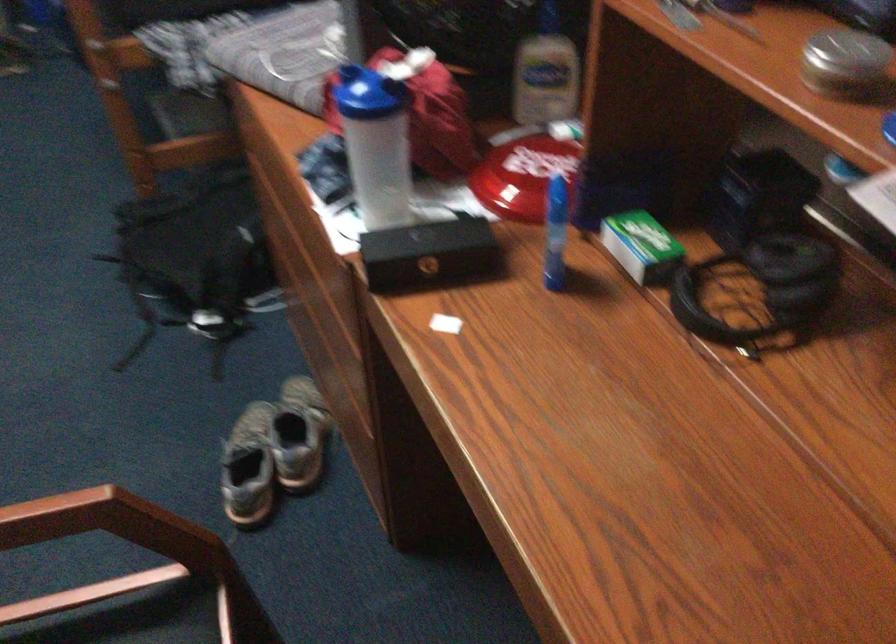
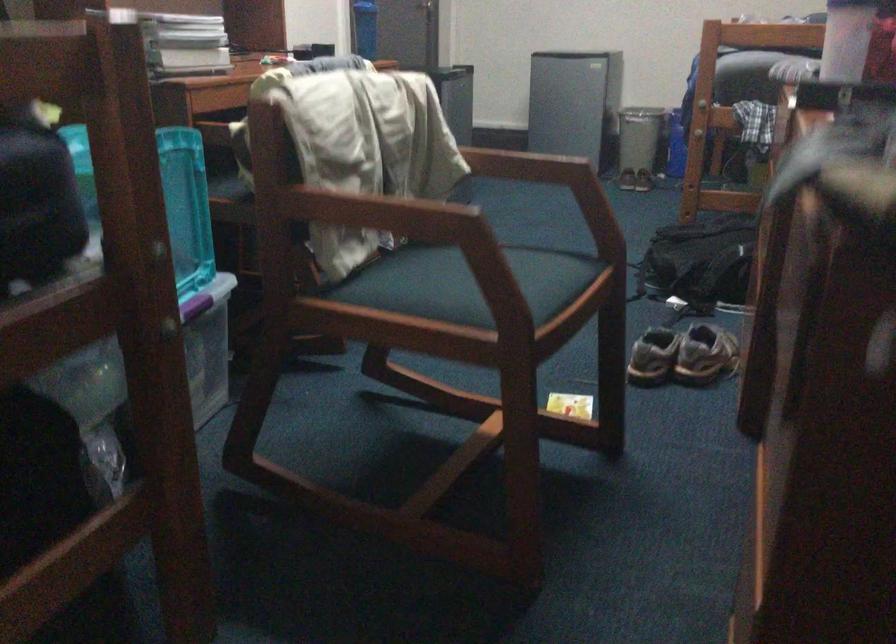
In the second image, find the point that corresponds to [281,474] in the first image.

(682, 355)